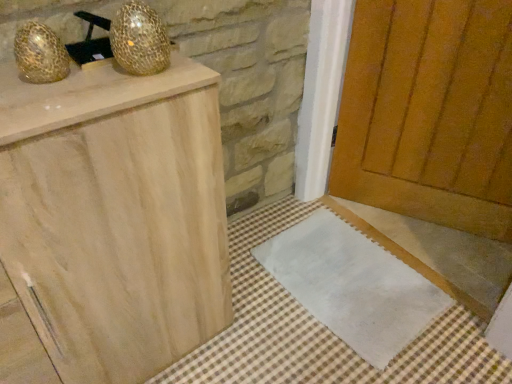
Measure the distance between wooden door at center and camera.

wooden door at center and camera are 4.22 feet apart from each other.

The image size is (512, 384). What do you see at coordinates (40, 54) in the screenshot? I see `gold textured egg at upper left, the second disco ball viewed from the right` at bounding box center [40, 54].

In order to face white fabric doormat at lower center, should I rotate leftwards or rightwards?

You should look right and rotate roughly 11.593 degrees.

At what (x,y) coordinates should I click in order to perform the action: click on wooden door at center. Please return your answer as a coordinate pair (x, y). Image resolution: width=512 pixels, height=384 pixels. Looking at the image, I should click on (429, 113).

Who is shorter, natural wood cabinet at left or wooden door at center?

natural wood cabinet at left is shorter.

Is natural wood cabinet at left positioned with its back to wooden door at center?

natural wood cabinet at left is not turned away from wooden door at center.

In terms of size, does natural wood cabinet at left appear bigger or smaller than wooden door at center?

Considering their sizes, natural wood cabinet at left takes up more space than wooden door at center.

Would you say natural wood cabinet at left is to the left or to the right of wooden door at center in the picture?

In the image, natural wood cabinet at left appears on the left side of wooden door at center.

From a real-world perspective, which is physically below, white fabric doormat at lower center or wooden door at center?

white fabric doormat at lower center, from a real-world perspective.

From the image's perspective, is white fabric doormat at lower center above or below wooden door at center?

white fabric doormat at lower center is situated lower than wooden door at center in the image.

The width and height of the screenshot is (512, 384). Find the location of `doormat beneath the wooden door at center (from a real-world perspective)`. doormat beneath the wooden door at center (from a real-world perspective) is located at coordinates (352, 285).

Between white fabric doormat at lower center and wooden door at center, which one has larger size?

wooden door at center is bigger.

Is wooden door at center to the left of white fabric doormat at lower center from the viewer's perspective?

In fact, wooden door at center is to the right of white fabric doormat at lower center.

Is wooden door at center positioned with its back to white fabric doormat at lower center?

No, wooden door at center is not facing the opposite direction of white fabric doormat at lower center.

Is wooden door at center bigger or smaller than white fabric doormat at lower center?

In the image, wooden door at center appears to be larger than white fabric doormat at lower center.

Considering the sizes of objects wooden door at center and white fabric doormat at lower center in the image provided, who is thinner, wooden door at center or white fabric doormat at lower center?

wooden door at center is thinner.

From a real-world perspective, is natural wood cabinet at left positioned above or below white fabric doormat at lower center?

natural wood cabinet at left is situated higher than white fabric doormat at lower center in the real world.

Looking at this image, between natural wood cabinet at left and white fabric doormat at lower center, which one has smaller size?

With smaller size is white fabric doormat at lower center.

Which is more to the right, natural wood cabinet at left or white fabric doormat at lower center?

From the viewer's perspective, white fabric doormat at lower center appears more on the right side.

Which point is more distant from viewer, (89, 160) or (62, 54)?

Point (62, 54)

In the scene shown: From a real-world perspective, between natural wood cabinet at left and gold textured egg at upper left, the second disco ball viewed from the right, who is vertically lower?

From a 3D spatial view, natural wood cabinet at left is below.

From the picture: Is natural wood cabinet at left inside or outside of gold textured egg at upper left, the second disco ball viewed from the right?

natural wood cabinet at left is not inside gold textured egg at upper left, the second disco ball viewed from the right, it's outside.

Can you confirm if gold mesh disco ball at upper left, the first disco ball when ordered from right to left, is shorter than wooden door at center?

Correct, gold mesh disco ball at upper left, the first disco ball when ordered from right to left, is not as tall as wooden door at center.

In the scene shown: Does gold mesh disco ball at upper left, the 2th disco ball when ordered from left to right, touch wooden door at center?

They are not placed beside each other.

Does gold mesh disco ball at upper left, the first disco ball when ordered from right to left, lie in front of wooden door at center?

Yes, it is.

What's the angular difference between gold mesh disco ball at upper left, the 2th disco ball when ordered from left to right, and wooden door at center's facing directions?

The facing directions of gold mesh disco ball at upper left, the 2th disco ball when ordered from left to right, and wooden door at center are 88.2 degrees apart.

I want to click on the 2nd disco ball in front when counting from the wooden door at center, so click(40, 54).

Is gold textured egg at upper left, the 1th disco ball in the left-to-right sequence, oriented towards wooden door at center?

No, gold textured egg at upper left, the 1th disco ball in the left-to-right sequence, does not turn towards wooden door at center.

Is gold textured egg at upper left, the second disco ball viewed from the right, far away from wooden door at center?

gold textured egg at upper left, the second disco ball viewed from the right, is far away from wooden door at center.

Do you think gold textured egg at upper left, the second disco ball viewed from the right, is within wooden door at center, or outside of it?

gold textured egg at upper left, the second disco ball viewed from the right, is spatially situated outside wooden door at center.

Locate an element on the screen. This screenshot has height=384, width=512. cabinetry lying below the wooden door at center (from the image's perspective) is located at coordinates (115, 216).

You are a GUI agent. You are given a task and a screenshot of the screen. Output one action in this format:
    pyautogui.click(x=<x>, y=<y>)
    Task: Click on the doormat on the left side of wooden door at center
    The image size is (512, 384).
    Given the screenshot: What is the action you would take?
    pyautogui.click(x=352, y=285)

Based on their spatial positions, is gold textured egg at upper left, the second disco ball viewed from the right, or natural wood cabinet at left further from wooden door at center?

Among the two, gold textured egg at upper left, the second disco ball viewed from the right, is located further to wooden door at center.

Looking at the image, which one is located further to white fabric doormat at lower center, gold textured egg at upper left, the 1th disco ball in the left-to-right sequence, or wooden door at center?

gold textured egg at upper left, the 1th disco ball in the left-to-right sequence, lies further to white fabric doormat at lower center than the other object.

From the image, which object appears to be farther from natural wood cabinet at left, gold mesh disco ball at upper left, the first disco ball when ordered from right to left, or white fabric doormat at lower center?

white fabric doormat at lower center is further to natural wood cabinet at left.

In the scene shown: Estimate the real-world distances between objects in this image. Which object is closer to natural wood cabinet at left, gold textured egg at upper left, the 1th disco ball in the left-to-right sequence, or gold mesh disco ball at upper left, the first disco ball when ordered from right to left?

gold mesh disco ball at upper left, the first disco ball when ordered from right to left, lies closer to natural wood cabinet at left than the other object.

Considering their positions, is white fabric doormat at lower center positioned further to wooden door at center than gold textured egg at upper left, the 1th disco ball in the left-to-right sequence?

The object further to wooden door at center is gold textured egg at upper left, the 1th disco ball in the left-to-right sequence.

From the image, which object appears to be nearer to natural wood cabinet at left, wooden door at center or gold textured egg at upper left, the 1th disco ball in the left-to-right sequence?

Based on the image, gold textured egg at upper left, the 1th disco ball in the left-to-right sequence, appears to be nearer to natural wood cabinet at left.

Based on their spatial positions, is gold mesh disco ball at upper left, the first disco ball when ordered from right to left, or wooden door at center closer to natural wood cabinet at left?

Among the two, gold mesh disco ball at upper left, the first disco ball when ordered from right to left, is located nearer to natural wood cabinet at left.

When comparing their distances from white fabric doormat at lower center, does natural wood cabinet at left or gold textured egg at upper left, the 1th disco ball in the left-to-right sequence, seem closer?

The object closer to white fabric doormat at lower center is natural wood cabinet at left.

Image resolution: width=512 pixels, height=384 pixels. Find the location of `disco ball situated between gold textured egg at upper left, the second disco ball viewed from the right, and white fabric doormat at lower center from left to right`. disco ball situated between gold textured egg at upper left, the second disco ball viewed from the right, and white fabric doormat at lower center from left to right is located at coordinates (139, 39).

Locate an element on the screen. doormat between gold mesh disco ball at upper left, the first disco ball when ordered from right to left, and wooden door at center, in the horizontal direction is located at coordinates (352, 285).

At what (x,y) coordinates should I click in order to perform the action: click on doormat between gold textured egg at upper left, the 1th disco ball in the left-to-right sequence, and wooden door at center. Please return your answer as a coordinate pair (x, y). This screenshot has width=512, height=384. Looking at the image, I should click on (352, 285).

At what (x,y) coordinates should I click in order to perform the action: click on disco ball located between gold textured egg at upper left, the 1th disco ball in the left-to-right sequence, and wooden door at center in the left-right direction. Please return your answer as a coordinate pair (x, y). Looking at the image, I should click on (139, 39).